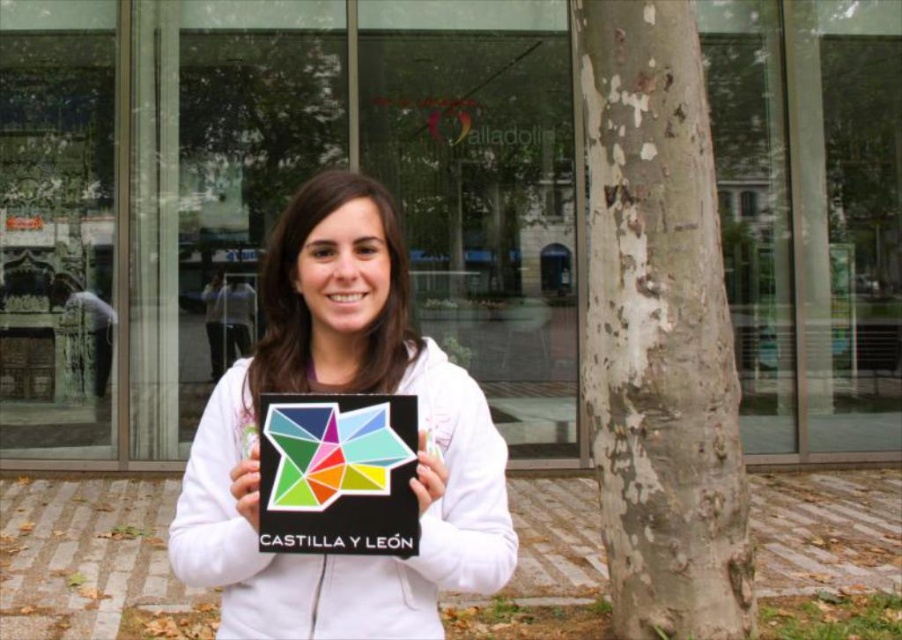
You are a painter who needs to place a 1.5 meter ladder between the white textured bark at center and the multicolored paper star at center. Will the ladder fit in the space between them?

The distance between the white textured bark at center and the multicolored paper star at center is 2.09 meters, so the 1.5 meter ladder will fit in the space between them since it is shorter than the available distance.

You are a photographer trying to capture the sign held by the person in the image. The sign is located at point (659, 332). You want to ensure that the background behind the sign is the white textured bark. Is the background at that point the white textured bark?

Yes, the point (659, 332) is on the white textured bark at center, so the background behind the sign is the white textured bark.

You are a photographer trying to capture the scene with two specific points of interest marked at coordinates point (692, 296) and point (336, 442). Which point is closer to the camera lens?

Point (692, 296) is further to the viewer than point (336, 442), so the point closer to the camera lens is point (336, 442).